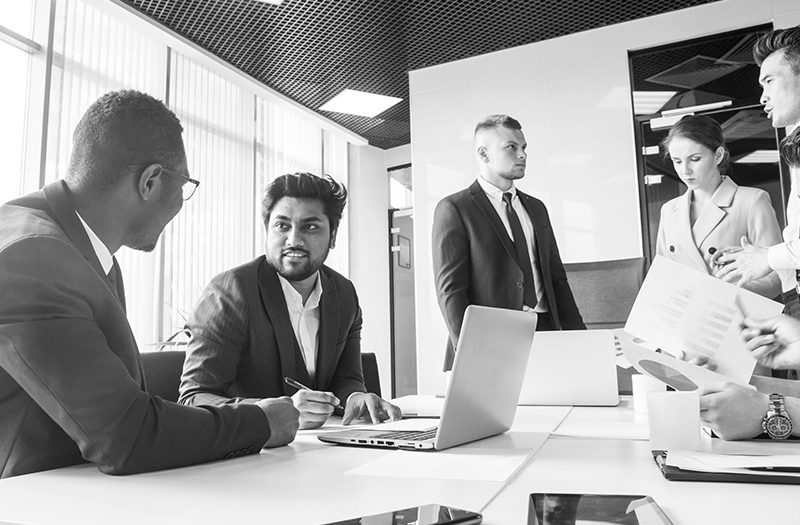
Identify the location of white table. point(572,453).